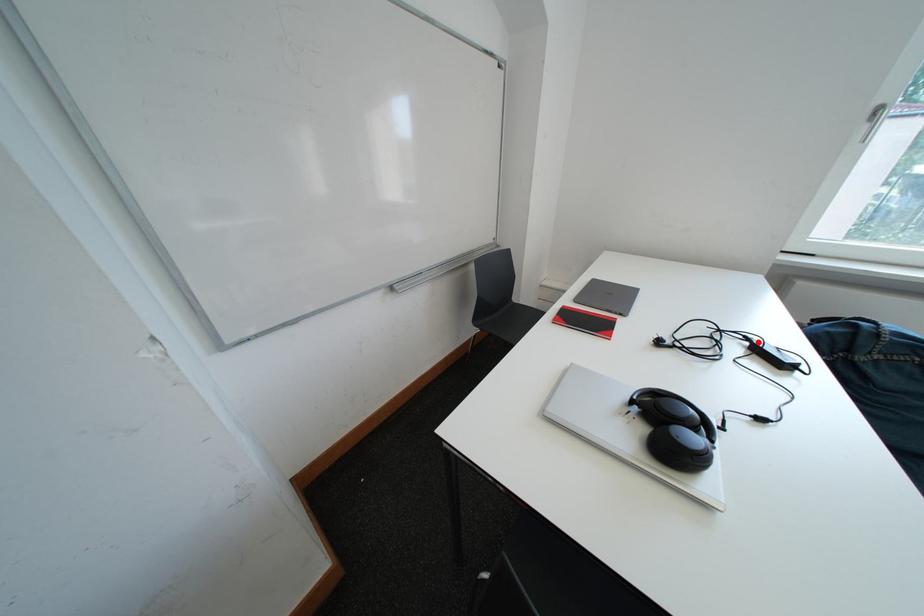
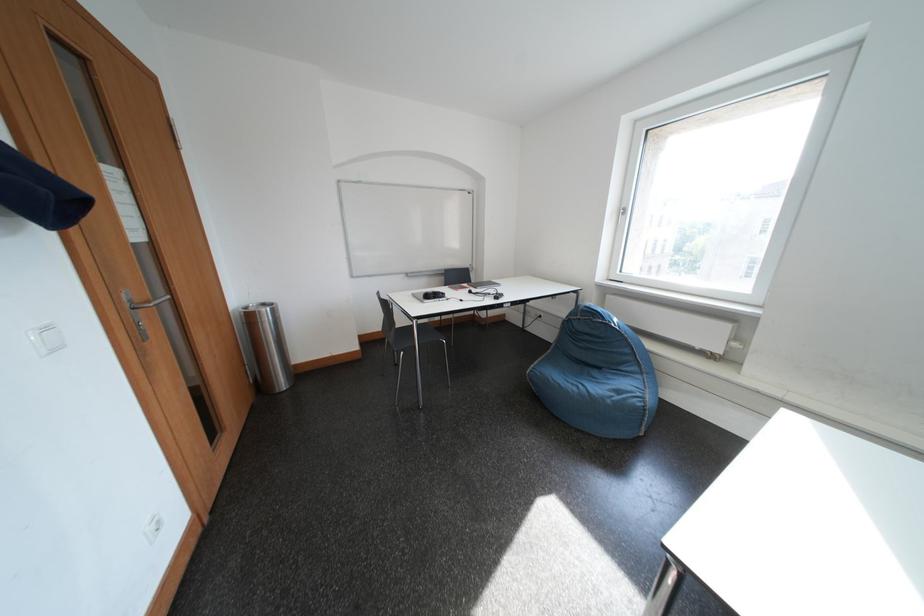
Question: I am providing you with two images of the same scene from different viewpoints. A red point is marked on the first image. At the location where the point appears in image 1, is it still visible in image 2?

Choices:
 (A) Yes
 (B) No

Answer: (B)